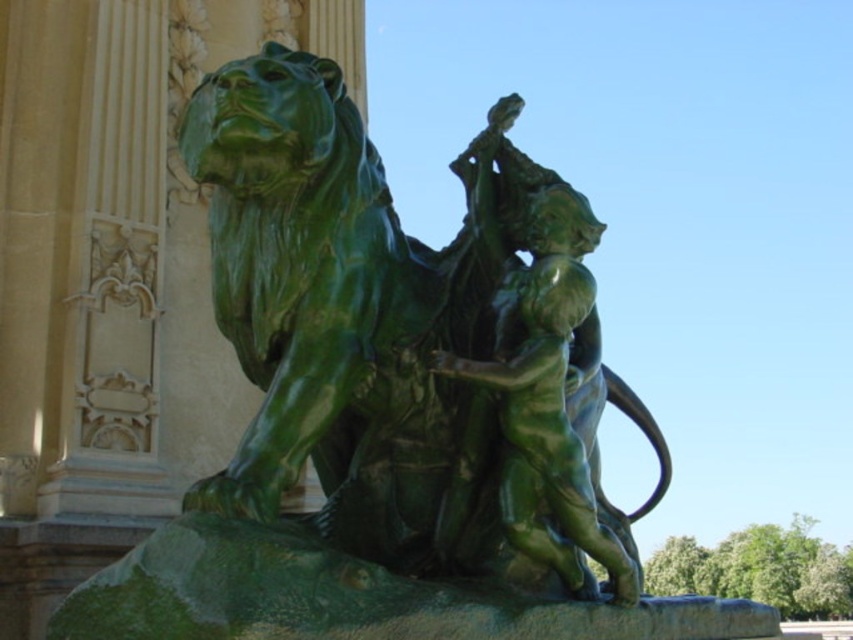
Between green polished stone lion at center and green polished bronze man at center, which one has less height?

Standing shorter between the two is green polished bronze man at center.

Between point (550, 573) and point (544, 272), which one is positioned in front?

Point (544, 272) is more forward.

Does point (518, 168) lie behind point (515, 525)?

That is True.

I want to click on green polished stone lion at center, so click(x=409, y=342).